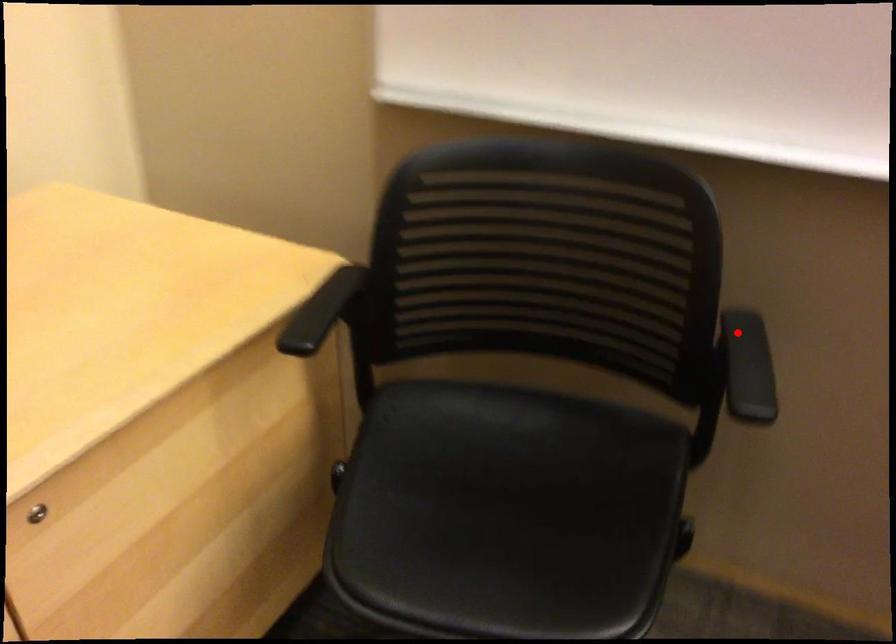
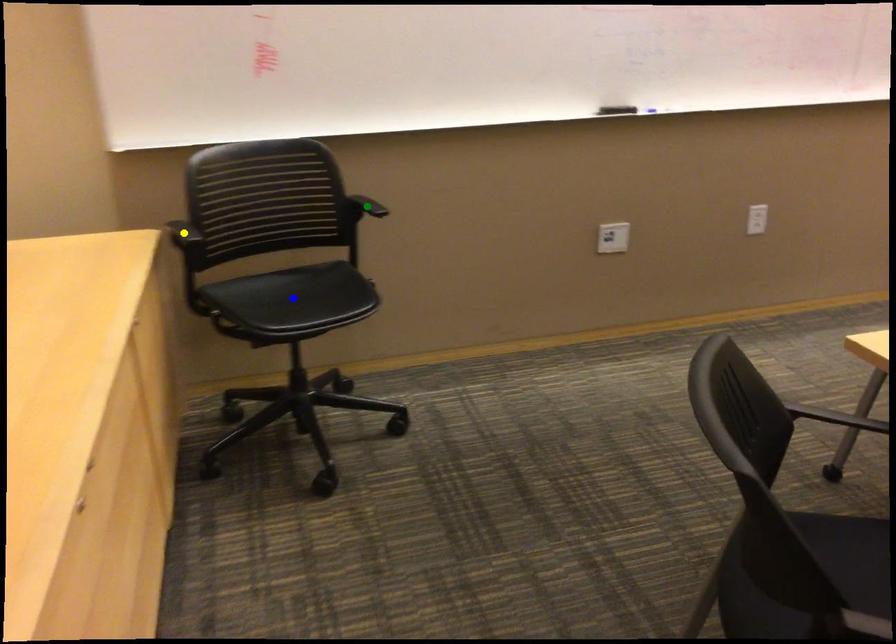
Question: I am providing you with two images of the same scene from different viewpoints. A red point is marked on the first image. You are given multiple points on the second image. In image 2, which mark is for the same physical point as the one in image 1?

Choices:
 (A) yellow point
 (B) green point
 (C) blue point

Answer: (B)